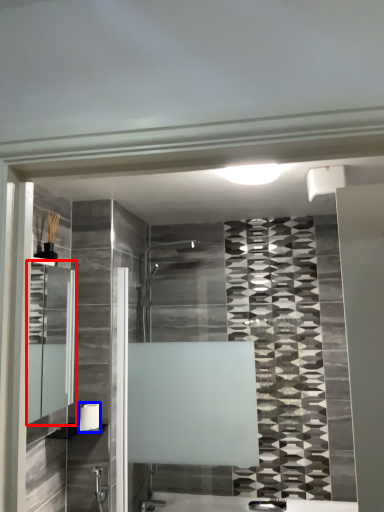
Question: Which point is closer to the camera, medicine cabinet (highlighted by a red box) or towel bar (highlighted by a blue box)?

Choices:
 (A) medicine cabinet
 (B) towel bar

Answer: (A)